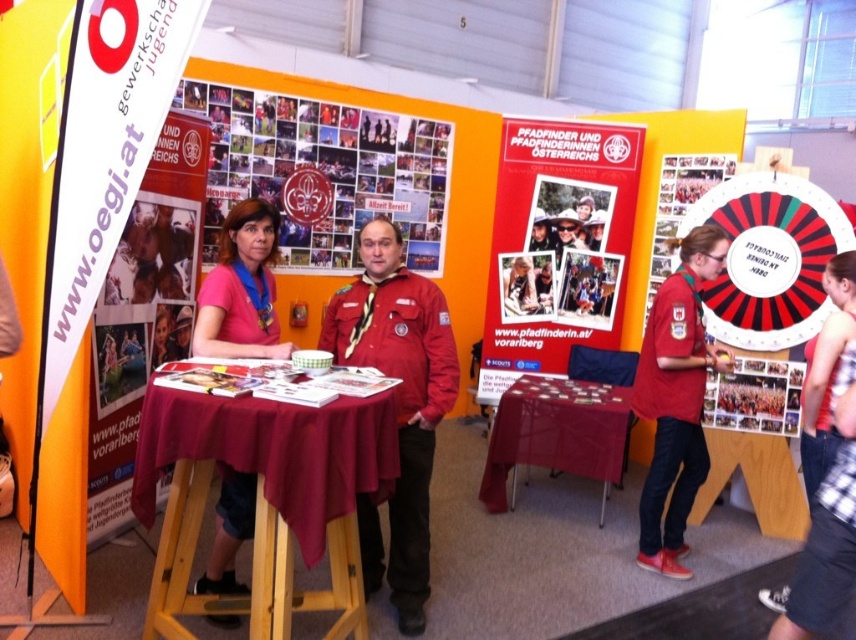
Can you confirm if matte paper collage at upper center is positioned to the right of red matte shirt at center?

No, matte paper collage at upper center is not to the right of red matte shirt at center.

Between point (286, 188) and point (642, 380), which one is positioned behind?

The point (286, 188) is behind.

This screenshot has height=640, width=856. Find the location of `matte paper collage at upper center`. matte paper collage at upper center is located at coordinates (324, 172).

This screenshot has height=640, width=856. In order to click on matte paper collage at upper center in this screenshot , I will do `click(324, 172)`.

Locate an element on the screen. orange paper poster at left is located at coordinates (143, 310).

The height and width of the screenshot is (640, 856). What do you see at coordinates (143, 310) in the screenshot? I see `orange paper poster at left` at bounding box center [143, 310].

Between point (105, 392) and point (703, 352), which one is positioned in front?

Positioned in front is point (105, 392).

Where is `orange paper poster at left`? The width and height of the screenshot is (856, 640). orange paper poster at left is located at coordinates (143, 310).

Is the position of matte paper collage at upper center less distant than that of red and black striped dartboard at upper right?

No.

Can you confirm if matte paper collage at upper center is wider than red and black striped dartboard at upper right?

Correct, the width of matte paper collage at upper center exceeds that of red and black striped dartboard at upper right.

Describe the element at coordinates (324, 172) in the screenshot. The width and height of the screenshot is (856, 640). I see `matte paper collage at upper center` at that location.

Image resolution: width=856 pixels, height=640 pixels. I want to click on matte paper collage at upper center, so click(x=324, y=172).